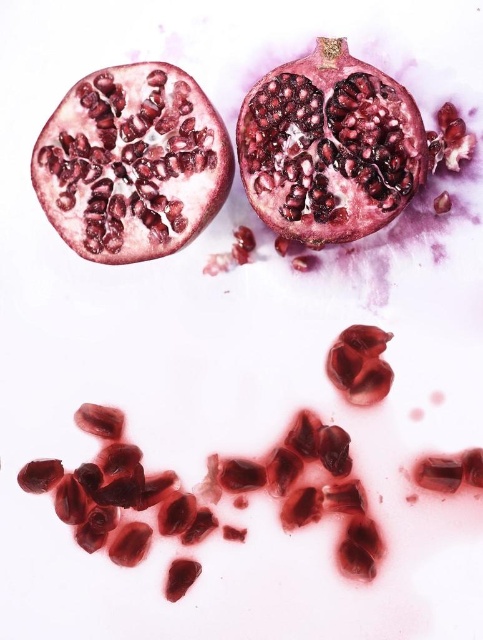
Question: Among these objects, which one is nearest to the camera?

Choices:
 (A) shiny red pomegranate at center
 (B) shiny red pomegranate seed at center
 (C) shiny red pomegranate at upper left

Answer: (A)

Question: Does shiny red pomegranate at center appear on the left side of shiny red pomegranate seed at center?

Choices:
 (A) yes
 (B) no

Answer: (A)

Question: Estimate the real-world distances between objects in this image. Which object is farther from the shiny red pomegranate at center?

Choices:
 (A) shiny red pomegranate seed at center
 (B) shiny red pomegranate at upper left

Answer: (A)

Question: Is shiny red pomegranate at upper left to the left of shiny red pomegranate seed at center from the viewer's perspective?

Choices:
 (A) no
 (B) yes

Answer: (B)

Question: Is shiny red pomegranate at upper left to the right of shiny red pomegranate seed at center from the viewer's perspective?

Choices:
 (A) no
 (B) yes

Answer: (A)

Question: Which point is farther from the camera taking this photo?

Choices:
 (A) (373, 198)
 (B) (375, 385)
 (C) (197, 160)

Answer: (B)